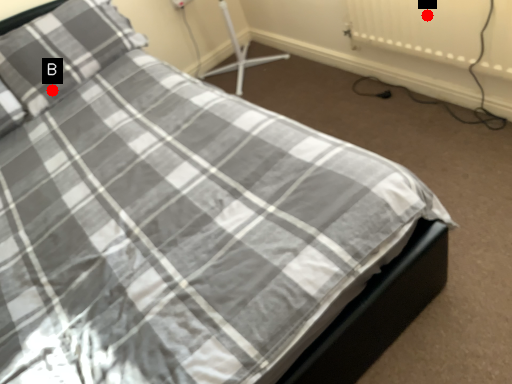
Question: Two points are circled on the image, labeled by A and B beside each circle. Which point is farther to the camera?

Choices:
 (A) A is further
 (B) B is further

Answer: (B)